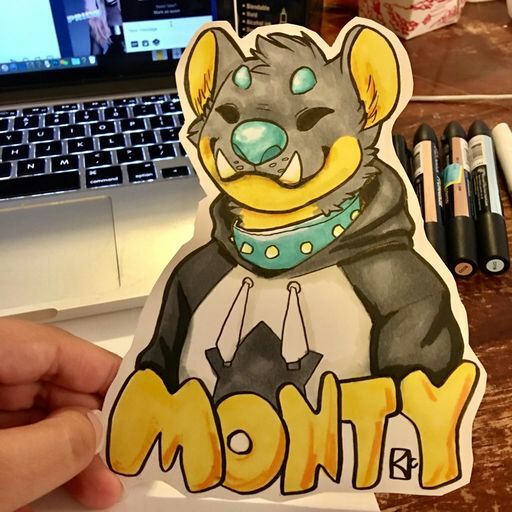
This screenshot has width=512, height=512. What are the coordinates of `screen` in the screenshot? It's located at (106, 33).